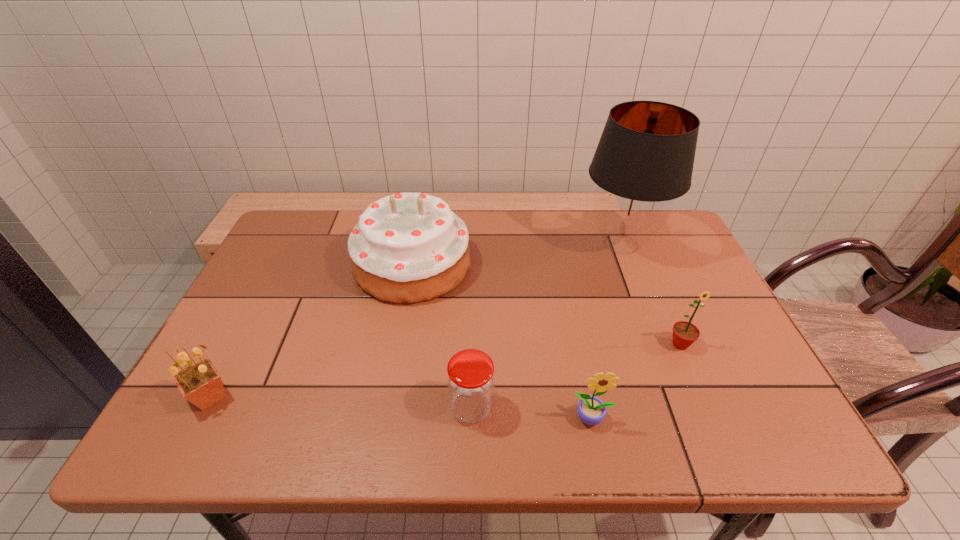
At what (x,y) coordinates should I click in order to perform the action: click on lampshade. Please return your answer as a coordinate pair (x, y). Looking at the image, I should click on (644, 159).

You are a GUI agent. You are given a task and a screenshot of the screen. Output one action in this format:
    pyautogui.click(x=<x>, y=<y>)
    Task: Click on the cake
    The image size is (960, 540).
    Given the screenshot: What is the action you would take?
    (407, 248)

At what (x,y) coordinates should I click in order to perform the action: click on the farthest sunflower. Please return your answer as a coordinate pair (x, y). Looking at the image, I should click on (685, 333).

Identify the location of the third farthest object. click(x=685, y=333).

Find the location of a particular element. This screenshot has width=960, height=540. the leftmost object is located at coordinates (200, 383).

The image size is (960, 540). What are the coordinates of `the second sunflower from right to left` in the screenshot? It's located at (591, 410).

Find the location of `the shortest object`. the shortest object is located at coordinates (470, 379).

Find the location of a particular element. The width and height of the screenshot is (960, 540). vacant space located on the front of the tallest object is located at coordinates (649, 317).

You are a GUI agent. You are given a task and a screenshot of the screen. Output one action in this format:
    pyautogui.click(x=<x>, y=<y>)
    Task: Click on the vacant space positioned on the right of the cake
    The height and width of the screenshot is (540, 960).
    Given the screenshot: What is the action you would take?
    pyautogui.click(x=489, y=265)

Identify the location of free spot located 0.110m on the face of the farthest sunflower. Image resolution: width=960 pixels, height=540 pixels. (702, 395).